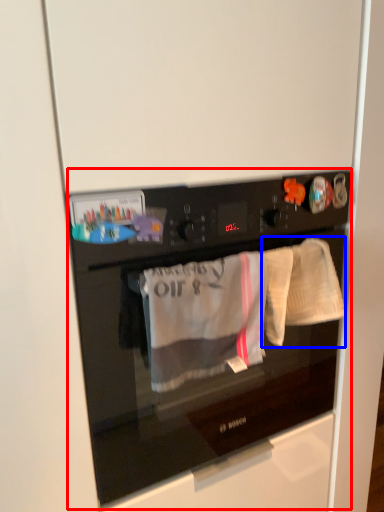
Question: Among these objects, which one is farthest to the camera, home appliance (highlighted by a red box) or baby clothe (highlighted by a blue box)?

Choices:
 (A) home appliance
 (B) baby clothe

Answer: (B)